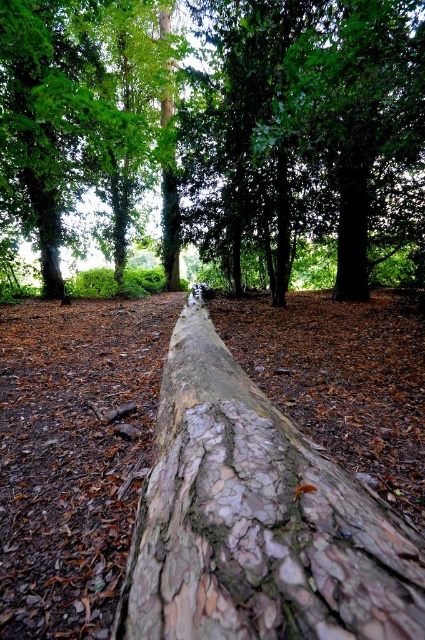
Question: Estimate the real-world distances between objects in this image. Which object is closer to the green rough bark tree at upper left?

Choices:
 (A) smooth bark log at center
 (B) rough bark log at center

Answer: (A)

Question: Considering the real-world distances, which object is closest to the green rough bark tree at upper left?

Choices:
 (A) smooth bark log at center
 (B) rough bark log at center

Answer: (A)

Question: In this image, where is smooth bark log at center located relative to rough bark log at center?

Choices:
 (A) below
 (B) above

Answer: (B)

Question: Is smooth bark log at center to the left of rough bark log at center from the viewer's perspective?

Choices:
 (A) no
 (B) yes

Answer: (B)

Question: Among these objects, which one is farthest from the camera?

Choices:
 (A) green rough bark tree at upper left
 (B) rough bark log at center
 (C) smooth bark log at center

Answer: (A)

Question: Can you confirm if smooth bark log at center is smaller than rough bark log at center?

Choices:
 (A) yes
 (B) no

Answer: (B)